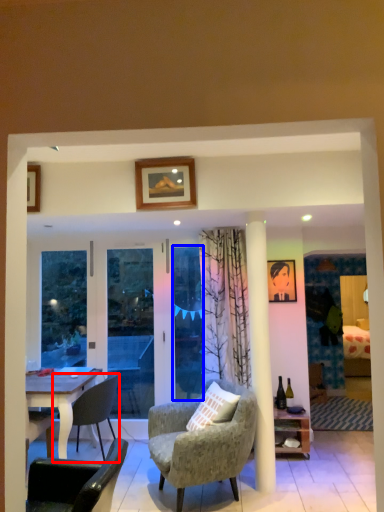
Question: Which object appears closest to the camera in this image, chair (highlighted by a red box) or glass door (highlighted by a blue box)?

Choices:
 (A) chair
 (B) glass door

Answer: (A)